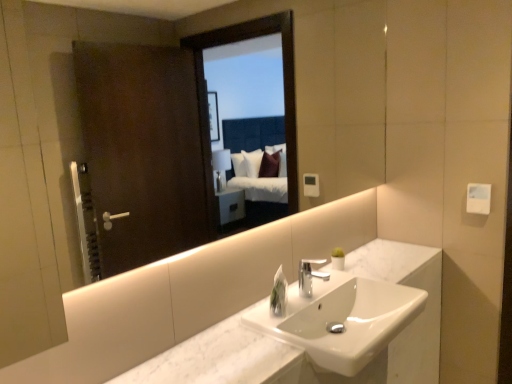
The image size is (512, 384). I want to click on vacant area that lies to the right of clear plastic soap dispenser at center, so click(303, 298).